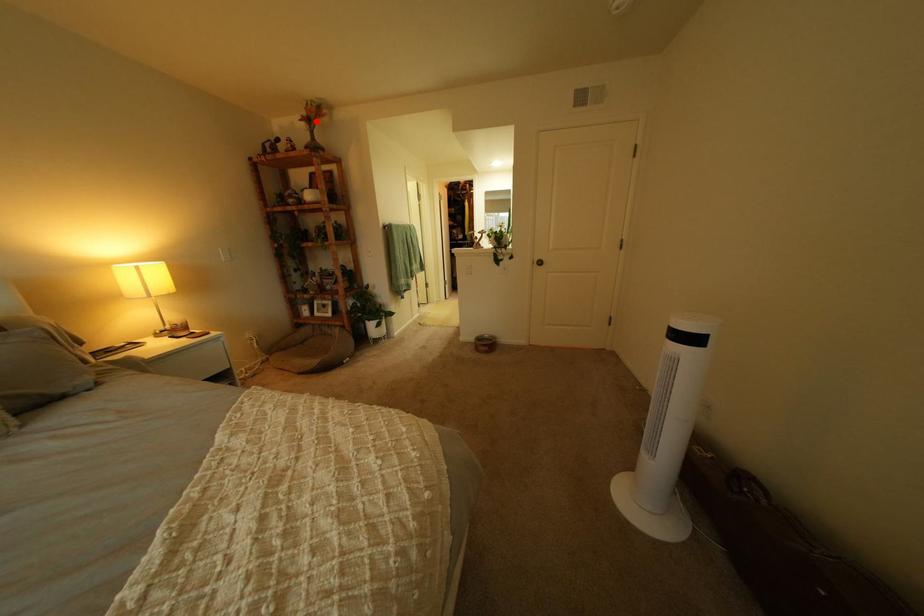
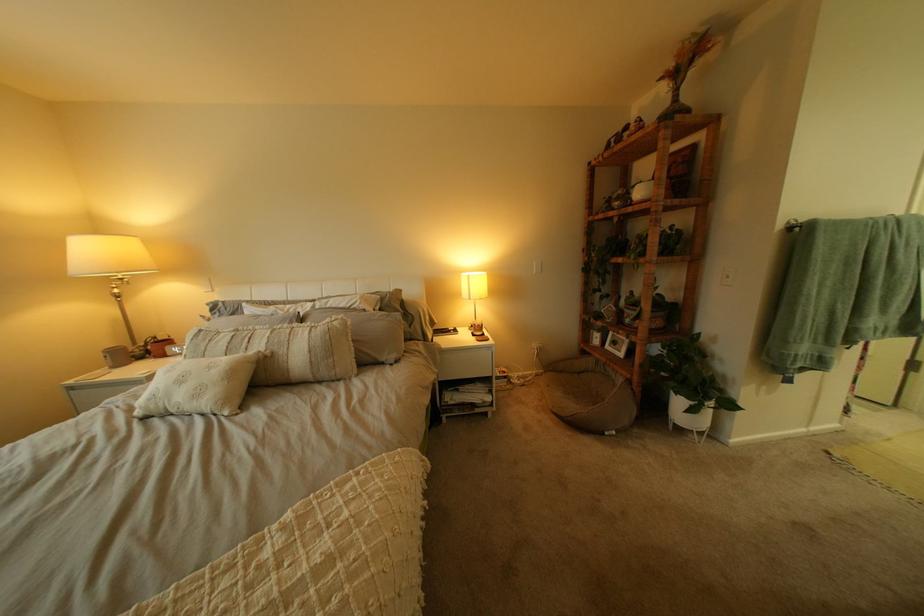
The point at the highlighted location is marked in the first image. Where is the corresponding point in the second image?

(675, 81)